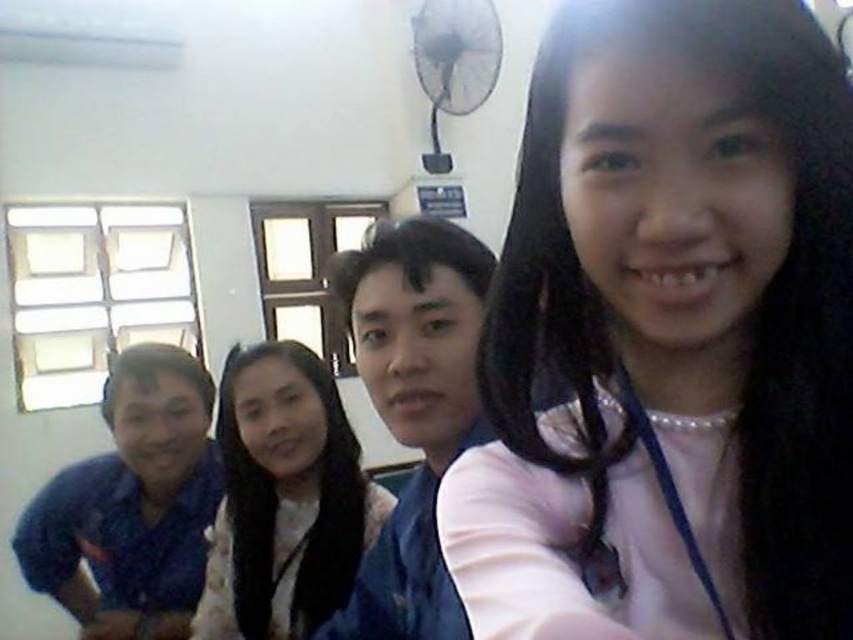
You are standing in the room and want to take a photo of the blue denim jacket at center and the smooth white shirt at center. Which one should you focus on to ensure the other is in the background?

You should focus on the blue denim jacket at center because it is closer to you than the smooth white shirt at center, so the smooth white shirt at center will be in the background.

You are standing in the room and want to take a photo of the pink fabric at center and the smooth white shirt at center. Which object should you focus on first to ensure both are in focus?

You should focus on the pink fabric at center first because it is closer to the viewer than the smooth white shirt at center, so adjusting focus starting from the closer object ensures both are in focus.